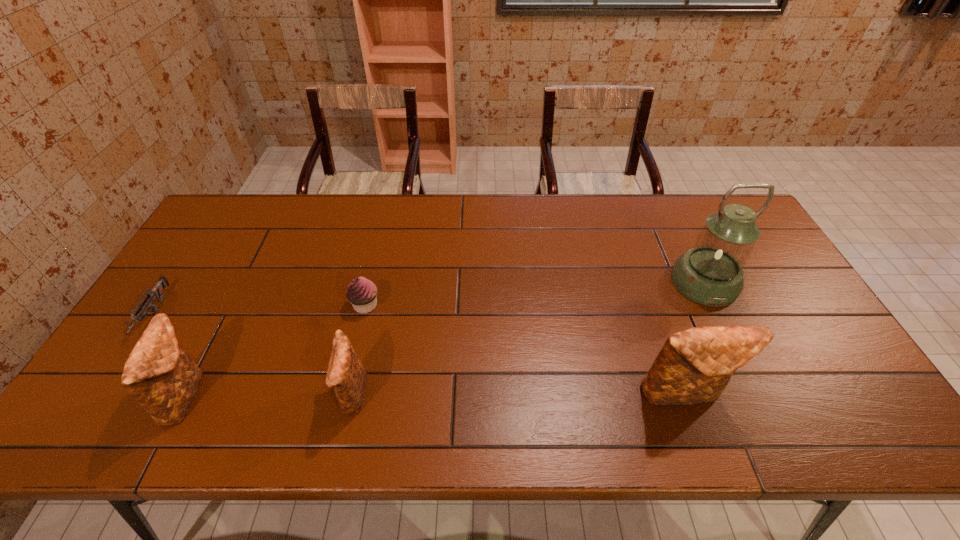
In the image, there is a desktop. Where is `free space at the near edge`? The width and height of the screenshot is (960, 540). free space at the near edge is located at coordinates coord(404,390).

The image size is (960, 540). Identify the location of free spot at the left edge of the desktop. (191, 307).

You are a GUI agent. You are given a task and a screenshot of the screen. Output one action in this format:
    pyautogui.click(x=<x>, y=<y>)
    Task: Click on the free spot at the near right corner of the desktop
    This screenshot has width=960, height=540.
    Given the screenshot: What is the action you would take?
    pyautogui.click(x=852, y=395)

This screenshot has height=540, width=960. Find the location of `free spot between the cupcake and the fifth shortest object`. free spot between the cupcake and the fifth shortest object is located at coordinates (524, 350).

Locate an element on the screen. empty space between the second shortest object and the tallest clutch bag is located at coordinates (524, 350).

Locate an element on the screen. vacant area between the fourth shortest object and the shortest clutch bag is located at coordinates (269, 395).

Where is `vacant point located between the tallest clutch bag and the fifth tallest object`? vacant point located between the tallest clutch bag and the fifth tallest object is located at coordinates (524, 350).

Where is `free space between the shortest clutch bag and the fifth object from right to left`? The height and width of the screenshot is (540, 960). free space between the shortest clutch bag and the fifth object from right to left is located at coordinates (269, 395).

Identify the location of vacant space in between the shortest object and the cupcake. (259, 310).

Where is `free spot between the tallest object and the gun`? The height and width of the screenshot is (540, 960). free spot between the tallest object and the gun is located at coordinates (x=429, y=298).